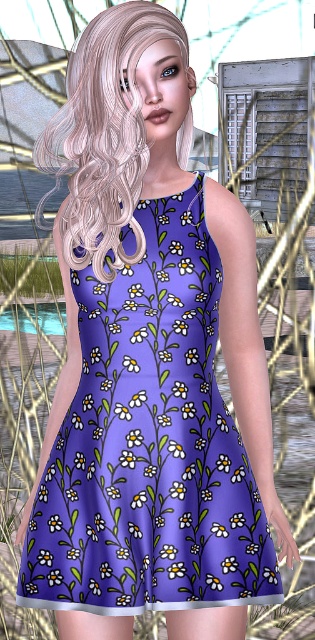
You are a photographer trying to capture the purple floral dress at center. You notice a point at coordinates (149, 444). Can you confirm if this point is located on the dress?

Yes, the point at (149, 444) is on the purple floral dress at center.

You are a photographer taking a portrait of the person in the purple floral dress at center and the blondehair at center. If you want to ensure both the dress and the hair are fully visible, should you adjust the camera angle to focus more on the front or the back?

Since the blondehair at center is behind the purple floral dress at center, adjusting the camera angle to focus more on the front will ensure both the dress and the hair are fully visible.

You are a photographer setting up for a photoshoot. You need to ensure that the purple floral dress at center and the blondehair at center are both visible in the frame. Based on their sizes, which object might require more space in the background to accommodate its width?

The purple floral dress at center might be wider than blondehair at center, so it requires more space in the background to accommodate its width.